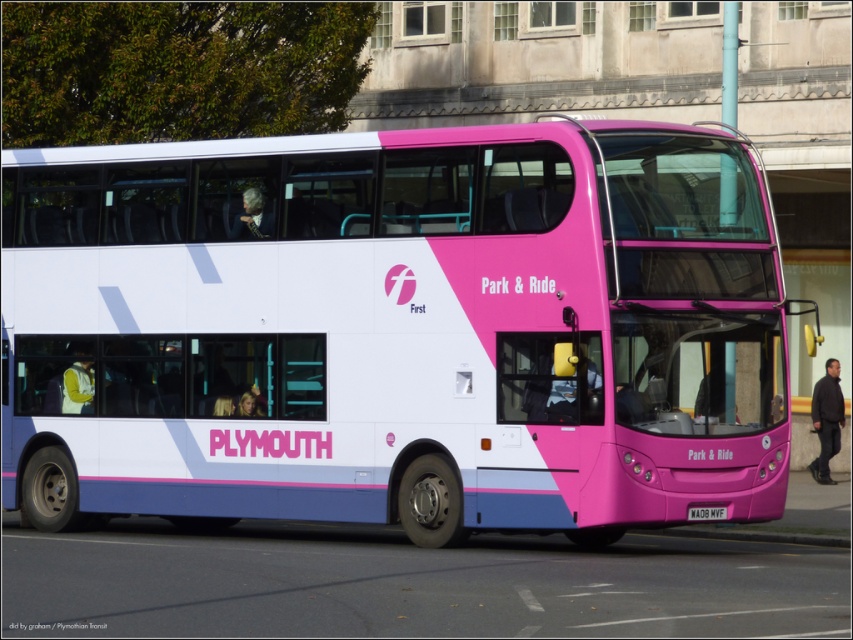
You are a photographer trying to capture the pink glossy bus at center and the white plastic license plate at lower center in a single photo. Since you want to ensure both are visible, which object should you focus on first to avoid blurring due to their size difference?

The pink glossy bus at center is taller than the white plastic license plate at lower center, so you should focus on the pink glossy bus at center first to ensure it is in sharp focus before adjusting for the smaller license plate.

You are standing in front of a double decker bus. There is a point at coordinates (396,330). What does this point indicate?

The point at coordinates (396,330) indicates the pink glossy bus at center.